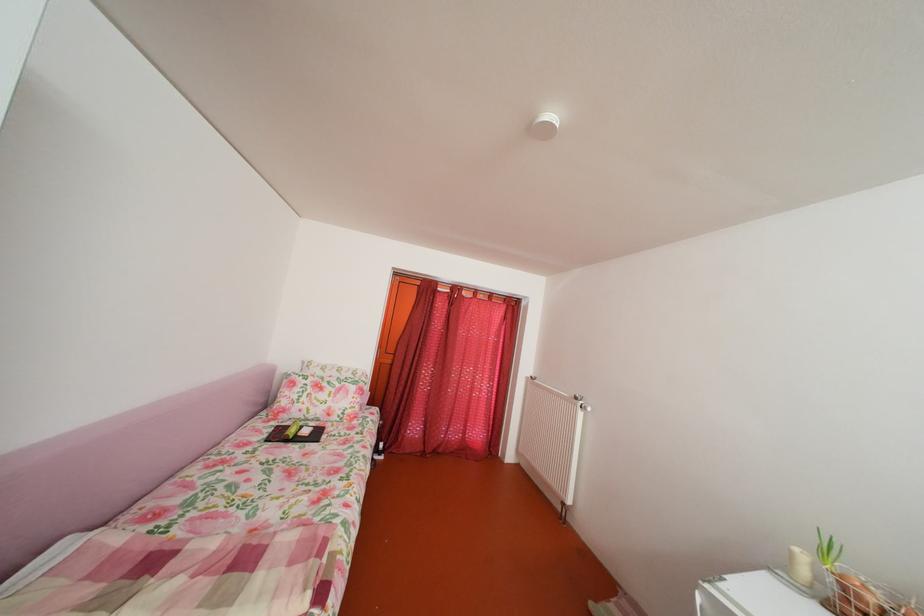
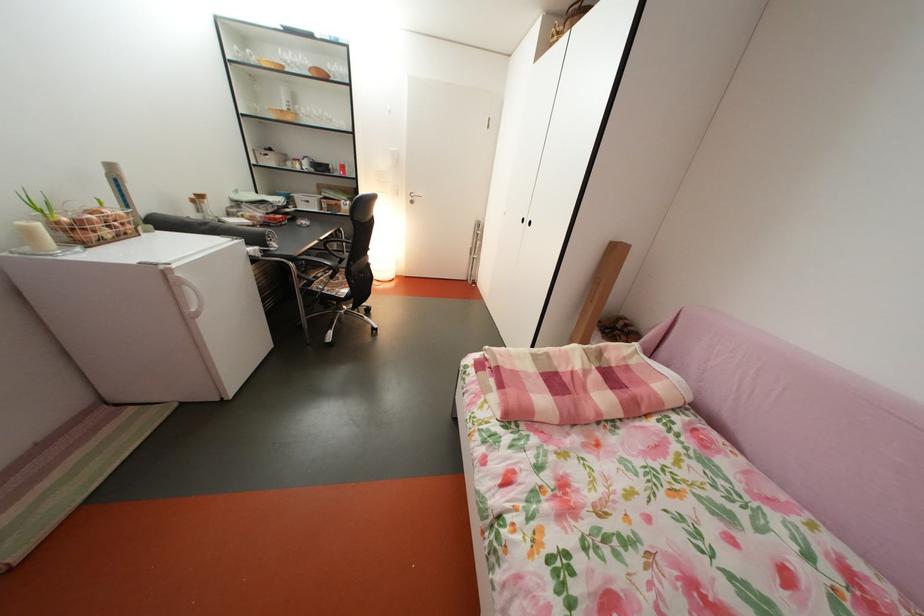
Question: I am providing you with two images of the same scene from different viewpoints. Which of the following objects are not visible in image2?

Choices:
 (A) rolled up mat
 (B) glass cup
 (C) white fridge handle
 (D) none of these

Answer: (D)